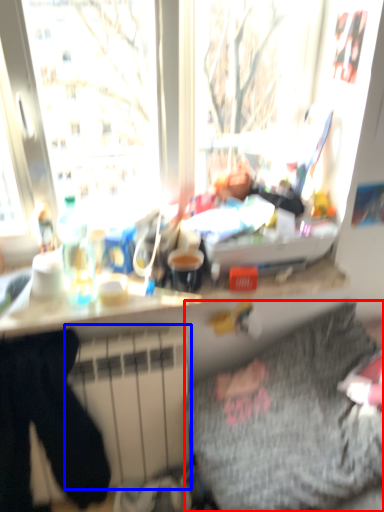
Question: Which object is further to the camera taking this photo, bedding (highlighted by a red box) or radiator (highlighted by a blue box)?

Choices:
 (A) bedding
 (B) radiator

Answer: (B)